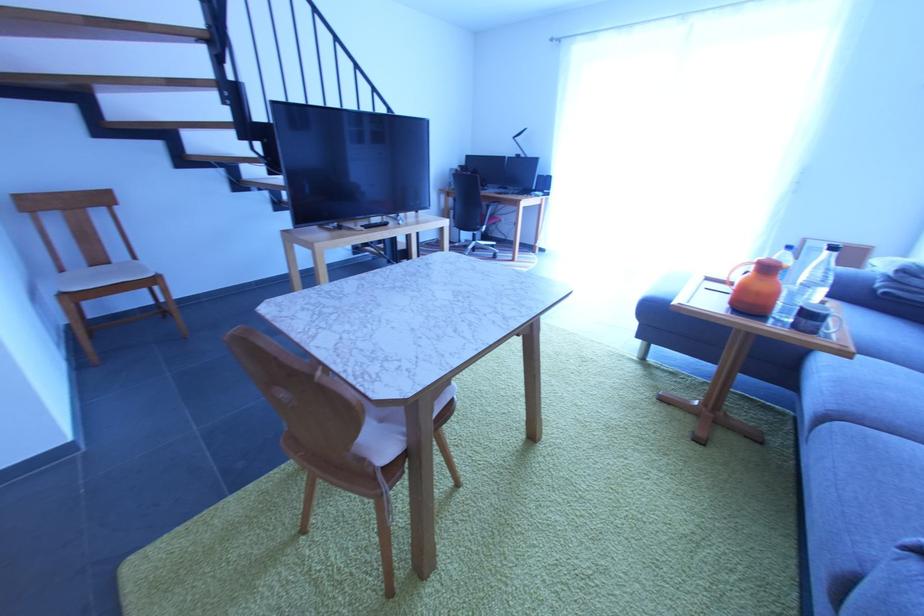
Locate an element on the screen. orange pitcher handle is located at coordinates (756, 286).